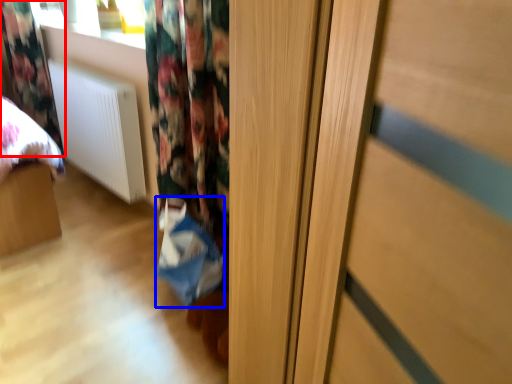
Question: Which of the following is the farthest to the observer, curtain (highlighted by a red box) or shopping bag (highlighted by a blue box)?

Choices:
 (A) curtain
 (B) shopping bag

Answer: (A)